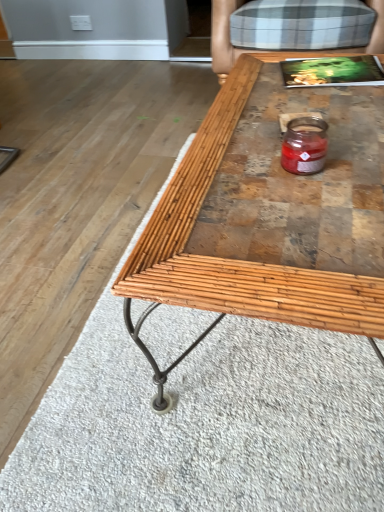
This screenshot has height=512, width=384. In order to click on unoccupied region to the right of translucent glass candle at center in this screenshot , I will do `click(362, 150)`.